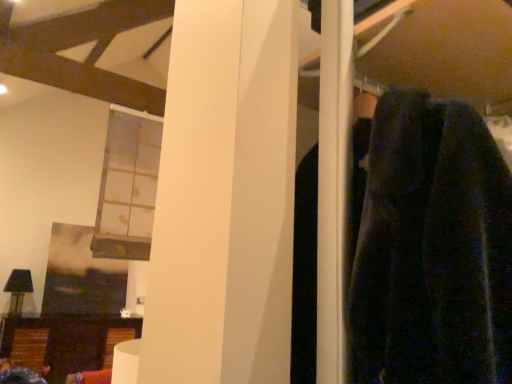
Question: Does translucent glass window at upper left have a lesser height compared to wooden side table at lower left?

Choices:
 (A) yes
 (B) no

Answer: (B)

Question: Is translucent glass window at upper left turned away from wooden side table at lower left?

Choices:
 (A) yes
 (B) no

Answer: (B)

Question: Can you confirm if translucent glass window at upper left is positioned to the right of wooden side table at lower left?

Choices:
 (A) yes
 (B) no

Answer: (A)

Question: Could you tell me if translucent glass window at upper left is facing wooden side table at lower left?

Choices:
 (A) no
 (B) yes

Answer: (B)

Question: From the image's perspective, is translucent glass window at upper left over wooden side table at lower left?

Choices:
 (A) no
 (B) yes

Answer: (B)

Question: Can you confirm if translucent glass window at upper left is taller than wooden side table at lower left?

Choices:
 (A) yes
 (B) no

Answer: (A)

Question: From the image's perspective, is wooden side table at lower left located above translucent glass window at upper left?

Choices:
 (A) yes
 (B) no

Answer: (B)

Question: From a real-world perspective, is wooden side table at lower left positioned over translucent glass window at upper left based on gravity?

Choices:
 (A) no
 (B) yes

Answer: (A)

Question: Is wooden side table at lower left positioned before translucent glass window at upper left?

Choices:
 (A) yes
 (B) no

Answer: (B)

Question: Is wooden side table at lower left positioned with its back to translucent glass window at upper left?

Choices:
 (A) yes
 (B) no

Answer: (B)

Question: From the image's perspective, is wooden side table at lower left beneath translucent glass window at upper left?

Choices:
 (A) yes
 (B) no

Answer: (A)

Question: Does wooden side table at lower left come behind translucent glass window at upper left?

Choices:
 (A) no
 (B) yes

Answer: (B)

Question: Choose the correct answer: Is translucent glass window at upper left inside wooden side table at lower left or outside it?

Choices:
 (A) inside
 (B) outside

Answer: (B)